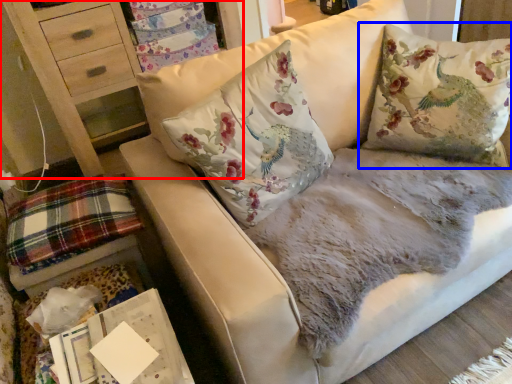
Question: Which object is closer to the camera taking this photo, furniture (highlighted by a red box) or pillow (highlighted by a blue box)?

Choices:
 (A) furniture
 (B) pillow

Answer: (B)